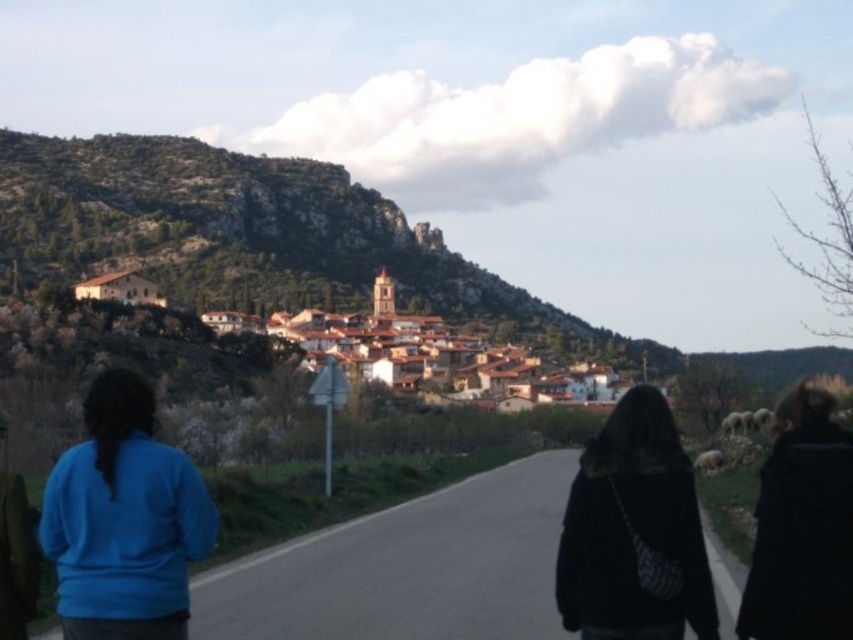
Question: Which object appears farthest from the camera in this image?

Choices:
 (A) black fuzzy coat at right
 (B) blue fleece jacket at lower left

Answer: (B)

Question: Does black fuzzy coat at lower right come in front of black fuzzy coat at right?

Choices:
 (A) yes
 (B) no

Answer: (B)

Question: Does black fuzzy coat at lower right lie in front of black fuzzy coat at right?

Choices:
 (A) no
 (B) yes

Answer: (A)

Question: Which of the following is the farthest from the observer?

Choices:
 (A) (683, 557)
 (B) (780, 483)

Answer: (B)

Question: Is black fuzzy coat at lower right positioned behind black fuzzy coat at right?

Choices:
 (A) no
 (B) yes

Answer: (B)

Question: Which object is farther from the camera taking this photo?

Choices:
 (A) brown rocky mountain at upper left
 (B) black fuzzy coat at right

Answer: (A)